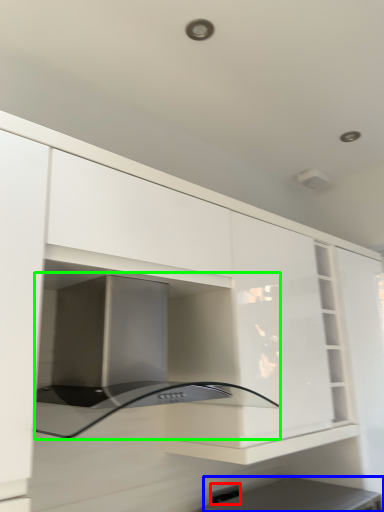
Question: Based on their relative distances, which object is farther from electric outlet (highlighted by a red box)? Choose from appliance (highlighted by a blue box) and oven (highlighted by a green box).

Choices:
 (A) appliance
 (B) oven

Answer: (B)